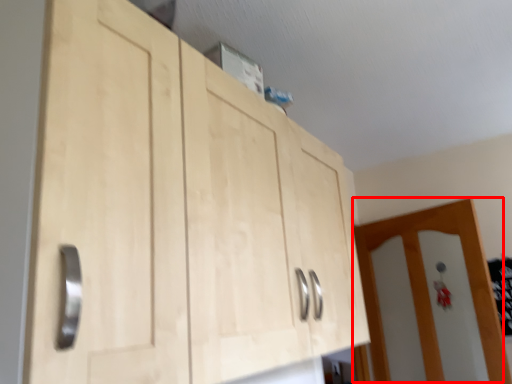
Question: From the image's perspective, where is door (annotated by the red box) located in relation to cupboard in the image?

Choices:
 (A) above
 (B) below

Answer: (B)